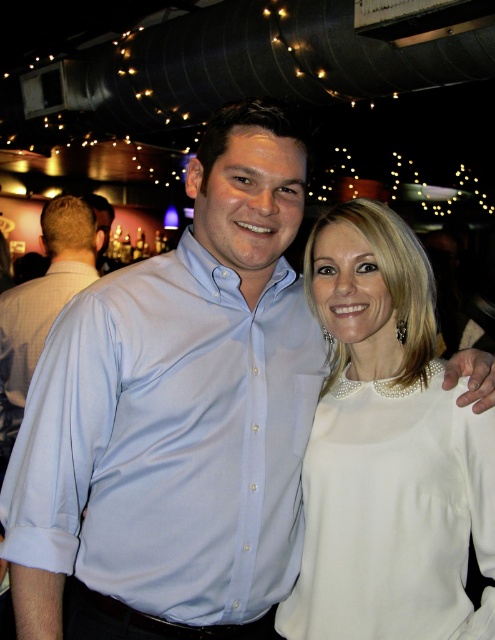
You are a photographer trying to capture a clear image of both the light blue satin shirt at center and the light blue shirt at center. Which shirt is closer to the left side of the camera frame?

The light blue shirt at center is closer to the left side of the camera frame because the light blue satin shirt at center is positioned on its right side.

You are taking a photo of two points in the scene. The first point is at coordinate point (x=151, y=570) and the second is at point (x=356, y=492). Which point is closer to the camera?

The point (x=151, y=570) is closer to the camera than point (x=356, y=492).

You are a photographer adjusting the lighting for a group photo. You notice the light blue satin shirt at center and the white satin blouse at center. Which one is closer to the string lights hanging above them?

The light blue satin shirt at center is positioned under the white satin blouse at center, so the white satin blouse at center is closer to the string lights hanging above them.